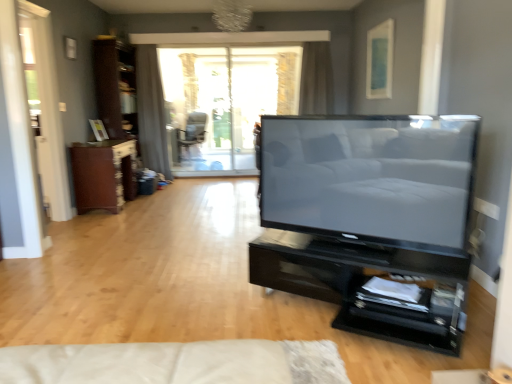
Question: Considering the positions of matte black chair at center and matte black tv at center in the image, is matte black chair at center taller or shorter than matte black tv at center?

Choices:
 (A) tall
 (B) short

Answer: (A)

Question: Looking at their shapes, would you say matte black chair at center is wider or thinner than matte black tv at center?

Choices:
 (A) thin
 (B) wide

Answer: (B)

Question: Which object is the farthest from the matte black chair at center?

Choices:
 (A) gray fabric curtain at upper center, positioned as the 2th curtain in right-to-left order
 (B) matte white picture frame at upper left, arranged as the 2th picture frame when viewed from the right
 (C) matte blue picture frame at upper right, the 2th picture frame when ordered from bottom to top
 (D) white glossy screen door at left
 (E) brown wood cabinet at left

Answer: (D)

Question: Based on their relative distances, which object is farther from the matte white picture frame at upper left, positioned as the 1th picture frame in left-to-right order?

Choices:
 (A) transparent glass window at center
 (B) brown wood cabinet at left
 (C) black glossy shelf at lower right
 (D) brown wood dresser at left
 (E) gray fabric curtain at upper center, positioned as the 2th curtain in right-to-left order

Answer: (C)